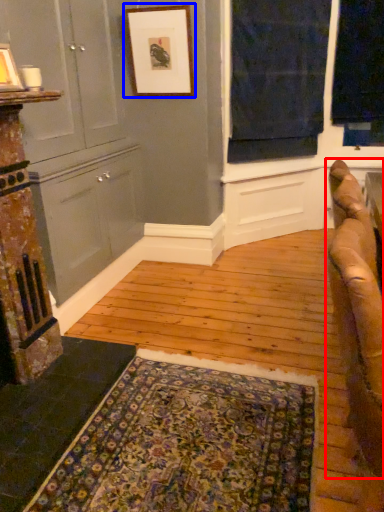
Question: Which object appears closest to the camera in this image, studio couch (highlighted by a red box) or picture frame (highlighted by a blue box)?

Choices:
 (A) studio couch
 (B) picture frame

Answer: (A)